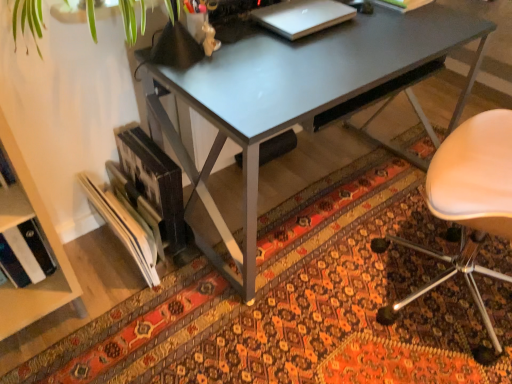
Question: From a real-world perspective, is sleek silver laptop at upper center positioned over beige leather chair at right based on gravity?

Choices:
 (A) no
 (B) yes

Answer: (B)

Question: Is sleek silver laptop at upper center not near beige leather chair at right?

Choices:
 (A) yes
 (B) no

Answer: (B)

Question: From the image's perspective, is sleek silver laptop at upper center beneath beige leather chair at right?

Choices:
 (A) yes
 (B) no

Answer: (B)

Question: Does sleek silver laptop at upper center have a greater height compared to beige leather chair at right?

Choices:
 (A) yes
 (B) no

Answer: (B)

Question: From a real-world perspective, is sleek silver laptop at upper center located beneath beige leather chair at right?

Choices:
 (A) yes
 (B) no

Answer: (B)

Question: Visually, is sleek silver laptop at upper center positioned to the left or to the right of hardcover book at upper center?

Choices:
 (A) left
 (B) right

Answer: (A)

Question: Relative to hardcover book at upper center, is sleek silver laptop at upper center in front or behind?

Choices:
 (A) front
 (B) behind

Answer: (A)

Question: From a real-world perspective, is sleek silver laptop at upper center physically located above or below hardcover book at upper center?

Choices:
 (A) above
 (B) below

Answer: (B)

Question: From the image's perspective, is sleek silver laptop at upper center positioned above or below hardcover book at upper center?

Choices:
 (A) above
 (B) below

Answer: (B)

Question: Looking at the image, does patterned carpet at lower center seem bigger or smaller compared to hardcover book at upper center?

Choices:
 (A) small
 (B) big

Answer: (B)

Question: Is point (35, 375) positioned closer to the camera than point (395, 8)?

Choices:
 (A) farther
 (B) closer

Answer: (B)

Question: Do you think patterned carpet at lower center is within hardcover book at upper center, or outside of it?

Choices:
 (A) outside
 (B) inside

Answer: (A)

Question: Is patterned carpet at lower center taller or shorter than hardcover book at upper center?

Choices:
 (A) short
 (B) tall

Answer: (A)

Question: Based on their positions, is beige leather chair at right located to the left or right of sleek silver laptop at upper center?

Choices:
 (A) left
 (B) right

Answer: (B)

Question: Considering the positions of beige leather chair at right and sleek silver laptop at upper center in the image, is beige leather chair at right taller or shorter than sleek silver laptop at upper center?

Choices:
 (A) short
 (B) tall

Answer: (B)